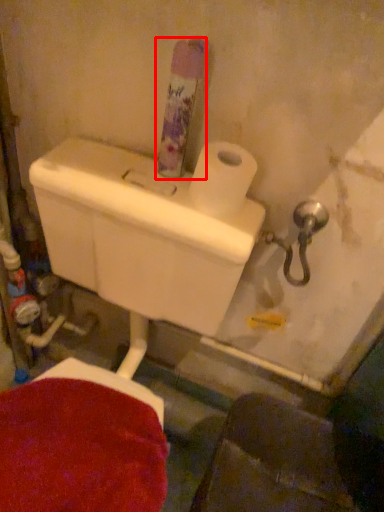
Question: From the image's perspective, what is the correct spatial positioning of toiletry (annotated by the red box) in reference to toilet paper?

Choices:
 (A) below
 (B) above

Answer: (B)